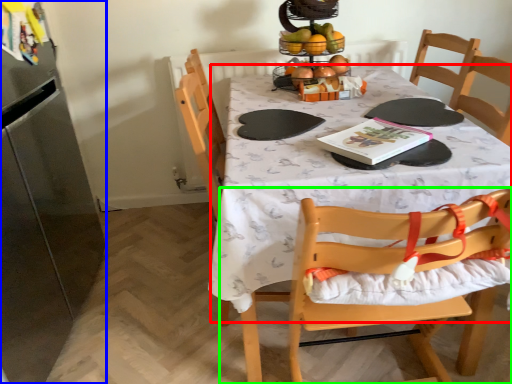
Question: Estimate the real-world distances between objects in this image. Which object is farther from tablecloth (highlighted by a red box), appliance (highlighted by a blue box) or chair (highlighted by a green box)?

Choices:
 (A) appliance
 (B) chair

Answer: (A)